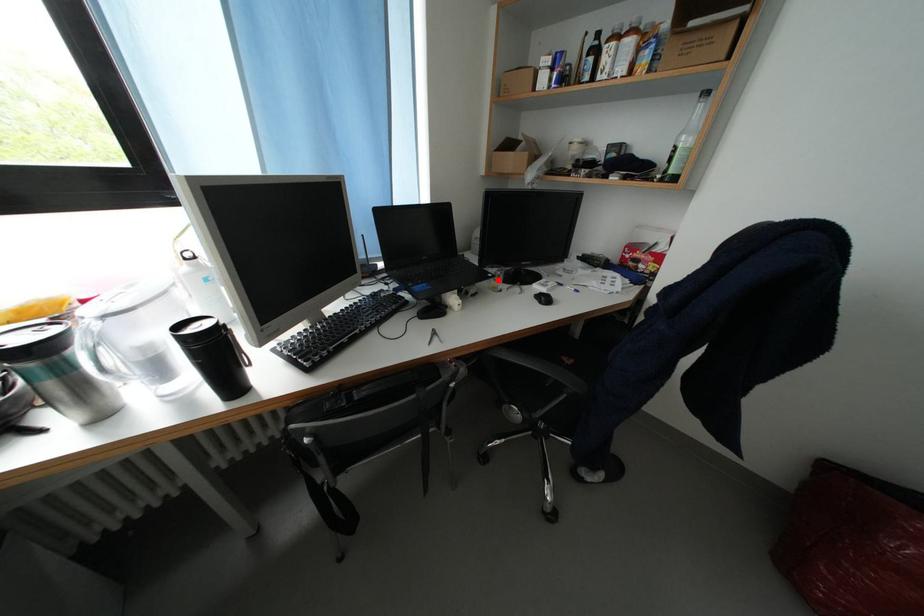
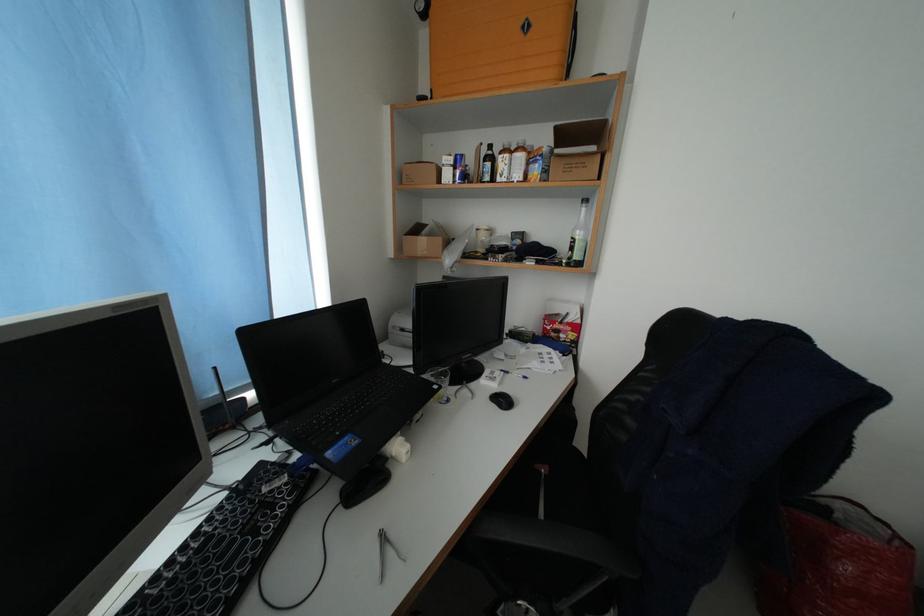
Where in the second image is the point corresponding to the highlighted location from the first image?

(444, 392)